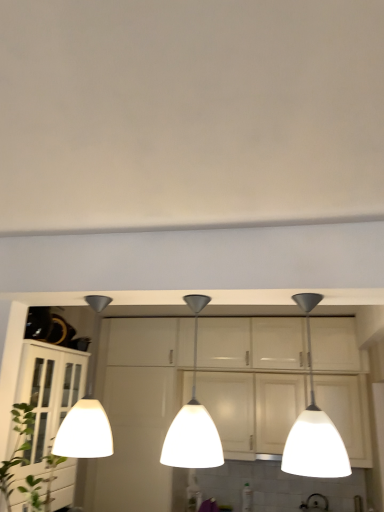
Question: Visually, is white glossy pendant light at left, which is the first lamp in left-to-right order, positioned to the left or to the right of green leafy plant at lower left?

Choices:
 (A) left
 (B) right

Answer: (B)

Question: From their relative heights in the image, would you say white glossy pendant light at left, arranged as the third lamp when viewed from the right, is taller or shorter than green leafy plant at lower left?

Choices:
 (A) tall
 (B) short

Answer: (A)

Question: Which is nearer to the green leafy plant at lower left?

Choices:
 (A) white glossy pendant light at left, which is the first lamp in left-to-right order
 (B) white glossy lampshade at right, positioned as the 3th lamp in left-to-right order
 (C) white glossy cabinet at left
 (D) white glass pendant light at center, which ranks as the second lamp in left-to-right order

Answer: (C)

Question: Which object is positioned closest to the white glossy cabinet at left?

Choices:
 (A) green leafy plant at lower left
 (B) white glass pendant light at center, which ranks as the second lamp in left-to-right order
 (C) white glossy pendant light at left, arranged as the third lamp when viewed from the right
 (D) white glossy lampshade at right, which appears as the first lamp when viewed from the right

Answer: (A)